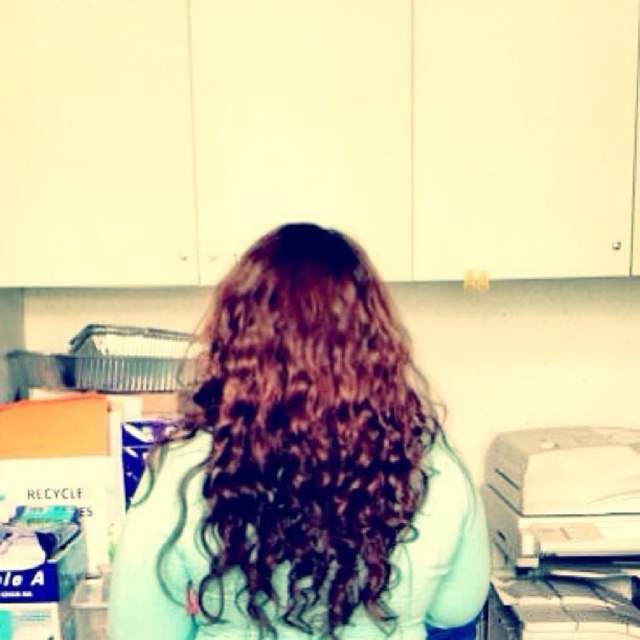
Based on the photo, which of these two, dark brown curly hair at center or white matte printer at lower right, stands taller?

A: dark brown curly hair at center

Between point (333, 552) and point (538, 556), which one is positioned behind?

The point (538, 556) is more distant.

This screenshot has width=640, height=640. What do you see at coordinates (300, 472) in the screenshot?
I see `dark brown curly hair at center` at bounding box center [300, 472].

Locate an element on the screen. dark brown curly hair at center is located at coordinates (300, 472).